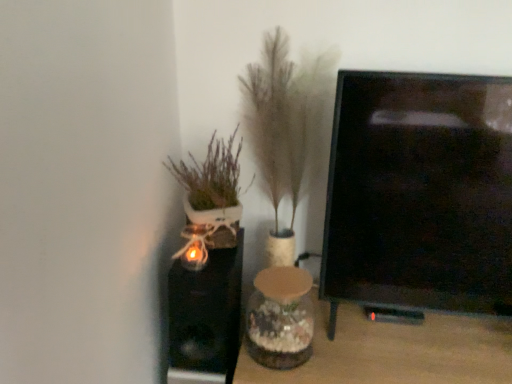
Question: Can you confirm if white ceramic pot at left, arranged as the second houseplant when viewed from the right, is thinner than clear glass vase at center?

Choices:
 (A) yes
 (B) no

Answer: (A)

Question: Is white ceramic pot at left, marked as the first houseplant in a left-to-right arrangement, facing away from clear glass vase at center?

Choices:
 (A) no
 (B) yes

Answer: (A)

Question: From a real-world perspective, is white ceramic pot at left, marked as the first houseplant in a left-to-right arrangement, positioned under clear glass vase at center based on gravity?

Choices:
 (A) no
 (B) yes

Answer: (A)

Question: From a real-world perspective, is white ceramic pot at left, marked as the first houseplant in a left-to-right arrangement, located higher than clear glass vase at center?

Choices:
 (A) yes
 (B) no

Answer: (A)

Question: From the image's perspective, is white ceramic pot at left, arranged as the second houseplant when viewed from the right, over clear glass vase at center?

Choices:
 (A) yes
 (B) no

Answer: (A)

Question: Is point (250, 304) positioned closer to the camera than point (353, 345)?

Choices:
 (A) closer
 (B) farther

Answer: (B)

Question: From a real-world perspective, is translucent glass vase at center positioned above or below clear glass vase at center?

Choices:
 (A) above
 (B) below

Answer: (A)

Question: Considering the positions of translucent glass vase at center and clear glass vase at center in the image, is translucent glass vase at center wider or thinner than clear glass vase at center?

Choices:
 (A) thin
 (B) wide

Answer: (A)

Question: Visually, is translucent glass vase at center positioned to the left or to the right of clear glass vase at center?

Choices:
 (A) left
 (B) right

Answer: (A)

Question: Considering the relative positions of fuzzy beige plant at center, which is the 1th houseplant from right to left, and white ceramic pot at left, marked as the first houseplant in a left-to-right arrangement, in the image provided, is fuzzy beige plant at center, which is the 1th houseplant from right to left, to the left or to the right of white ceramic pot at left, marked as the first houseplant in a left-to-right arrangement,?

Choices:
 (A) right
 (B) left

Answer: (A)

Question: In terms of height, does fuzzy beige plant at center, which is the 1th houseplant from right to left, look taller or shorter compared to white ceramic pot at left, marked as the first houseplant in a left-to-right arrangement?

Choices:
 (A) short
 (B) tall

Answer: (B)

Question: Is point (272, 125) closer or farther from the camera than point (210, 215)?

Choices:
 (A) closer
 (B) farther

Answer: (B)

Question: Based on their sizes in the image, would you say fuzzy beige plant at center, which is the 1th houseplant from right to left, is bigger or smaller than white ceramic pot at left, marked as the first houseplant in a left-to-right arrangement?

Choices:
 (A) small
 (B) big

Answer: (B)

Question: In terms of width, does white ceramic pot at left, arranged as the second houseplant when viewed from the right, look wider or thinner when compared to fuzzy beige plant at center, which is the 1th houseplant from right to left?

Choices:
 (A) thin
 (B) wide

Answer: (A)

Question: From a real-world perspective, is white ceramic pot at left, marked as the first houseplant in a left-to-right arrangement, above or below fuzzy beige plant at center, the 2th houseplant when ordered from left to right?

Choices:
 (A) below
 (B) above

Answer: (B)